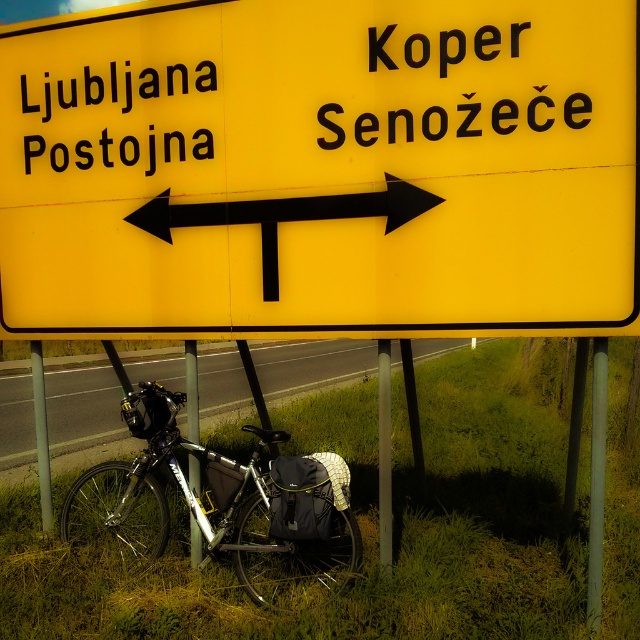
Question: Which object appears closest to the camera in this image?

Choices:
 (A) yellow plastic sign at center
 (B) black matte arrow at center
 (C) metallic silver pole at lower left
 (D) gray metallic pole at right

Answer: (A)

Question: Is the position of black matte arrow at center more distant than that of gray metallic pole at right?

Choices:
 (A) yes
 (B) no

Answer: (A)

Question: Among these points, which one is nearest to the camera?

Choices:
 (A) (600, 371)
 (B) (312, 484)
 (C) (381, 534)
 (D) (4, 397)

Answer: (A)

Question: Considering the relative positions of metallic bicycle at lower left and silver metallic bicycle at lower center in the image provided, where is metallic bicycle at lower left located with respect to silver metallic bicycle at lower center?

Choices:
 (A) below
 (B) above

Answer: (B)

Question: Among these objects, which one is nearest to the camera?

Choices:
 (A) metallic silver bicycle at lower left
 (B) black matte arrow at center
 (C) yellow plastic sign at center
 (D) metallic gray pole at lower left

Answer: (C)

Question: Can you confirm if yellow plastic sign at center is positioned above metallic silver pole at lower left?

Choices:
 (A) yes
 (B) no

Answer: (A)